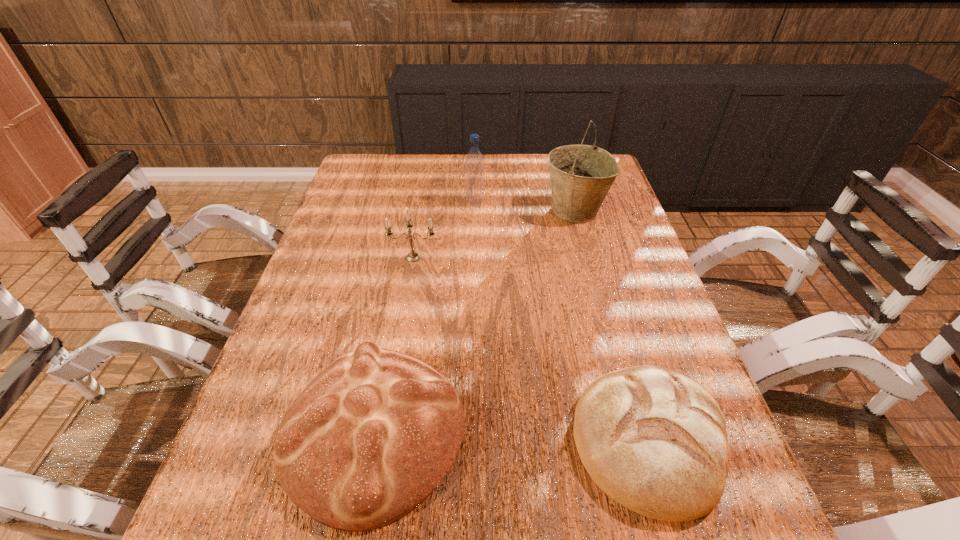
The image size is (960, 540). I want to click on vacant space at the right edge, so click(x=646, y=309).

Find the location of a particular element. The width and height of the screenshot is (960, 540). free space at the far left corner of the desktop is located at coordinates (389, 157).

Locate an element on the screen. The width and height of the screenshot is (960, 540). unoccupied position between the water bottle and the shortest object is located at coordinates (563, 322).

Find the location of a particular element. unoccupied position between the wine bucket and the candle is located at coordinates (493, 234).

At what (x,y) coordinates should I click in order to perform the action: click on vacant space that is in between the tallest object and the water bottle. Please return your answer as a coordinate pair (x, y). Looking at the image, I should click on (525, 207).

In order to click on free space between the water bottle and the wine bucket in this screenshot , I will do `click(525, 207)`.

The width and height of the screenshot is (960, 540). Find the location of `free space between the third shortest object and the right bread`. free space between the third shortest object and the right bread is located at coordinates (532, 349).

Locate an element on the screen. This screenshot has width=960, height=540. vacant area that lies between the right bread and the third farthest object is located at coordinates (532, 349).

At what (x,y) coordinates should I click in order to perform the action: click on free space between the fourth shortest object and the taller bread. Please return your answer as a coordinate pair (x, y). Looking at the image, I should click on (424, 318).

Identify the location of unoccupied area between the third nearest object and the fourth tallest object. The height and width of the screenshot is (540, 960). (394, 345).